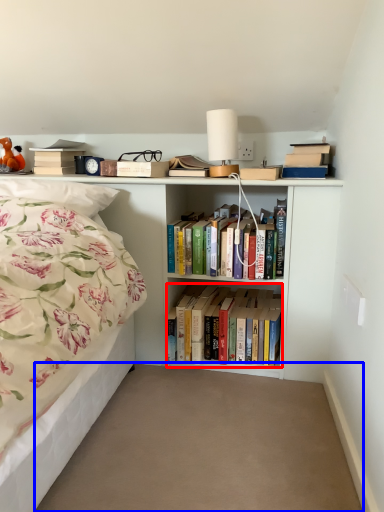
Question: Which object is closer to the camera taking this photo, book (highlighted by a red box) or plain (highlighted by a blue box)?

Choices:
 (A) book
 (B) plain

Answer: (B)